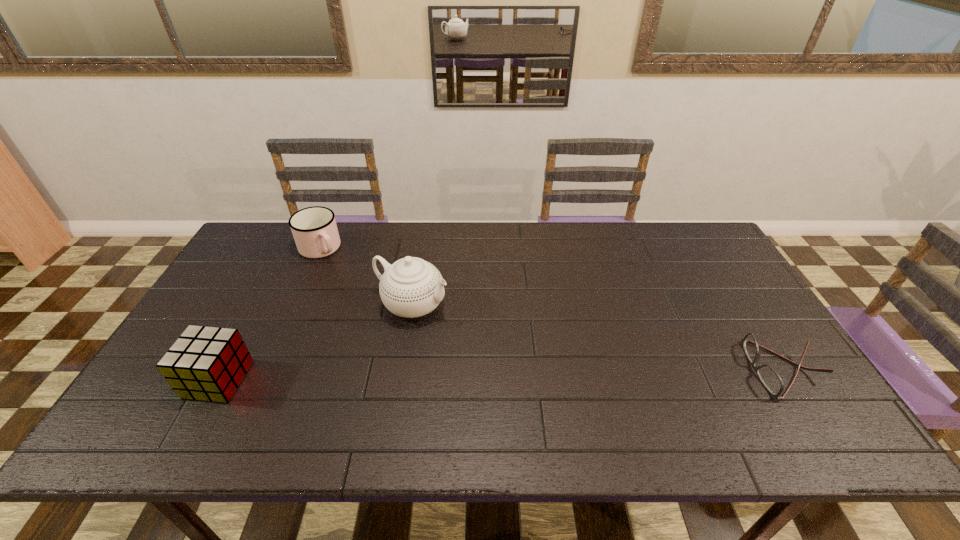
Locate an element on the screen. The width and height of the screenshot is (960, 540). free space between the cube and the farthest object is located at coordinates (269, 314).

Find the location of `vacant space that's between the rightmost object and the cube`. vacant space that's between the rightmost object and the cube is located at coordinates (501, 375).

In order to click on empty space between the shortest object and the farthest object in this screenshot , I will do `click(552, 309)`.

This screenshot has height=540, width=960. Identify the location of free space between the chinaware and the cube. coord(315,342).

At what (x,y) coordinates should I click in order to perform the action: click on free space between the mug and the cube. Please return your answer as a coordinate pair (x, y). The image size is (960, 540). Looking at the image, I should click on (269, 314).

This screenshot has height=540, width=960. Identify the location of free space that is in between the spectacles and the farthest object. (552, 309).

The width and height of the screenshot is (960, 540). What are the coordinates of `empty space between the farthest object and the cube` in the screenshot? It's located at (269, 314).

Where is `blank region between the shortest object and the chinaware`? The height and width of the screenshot is (540, 960). blank region between the shortest object and the chinaware is located at coordinates (598, 338).

Identify which object is the second closest to the chinaware. Please provide its 2D coordinates. Your answer should be formatted as a tuple, i.e. [(x, y)], where the tuple contains the x and y coordinates of a point satisfying the conditions above.

[(205, 363)]

Identify the location of object that can be found as the third closest to the cube. (771, 380).